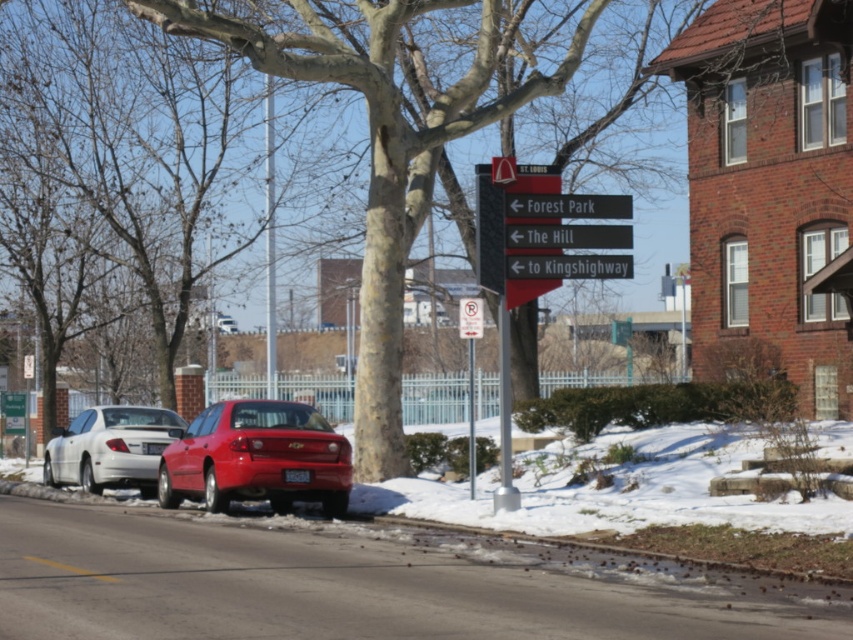
Question: Can you confirm if white glossy sedan at center is smaller than black matte sign at center?

Choices:
 (A) yes
 (B) no

Answer: (B)

Question: Does black plastic sign at upper center have a greater width compared to white paper sign at center?

Choices:
 (A) yes
 (B) no

Answer: (A)

Question: Among these points, which one is farthest from the camera?

Choices:
 (A) (322, 419)
 (B) (543, 209)
 (C) (107, 435)
 (D) (606, 262)

Answer: (C)

Question: Is shiny red sedan at center further to the viewer compared to metallic silver sign at center?

Choices:
 (A) yes
 (B) no

Answer: (A)

Question: Which object is positioned closest to the black plastic sign at upper center?

Choices:
 (A) bare wood tree at center
 (B) shiny red sedan at center
 (C) black matte sign at center

Answer: (C)

Question: Which point is closer to the camera?

Choices:
 (A) bare wood tree at center
 (B) white paper sign at center

Answer: (A)